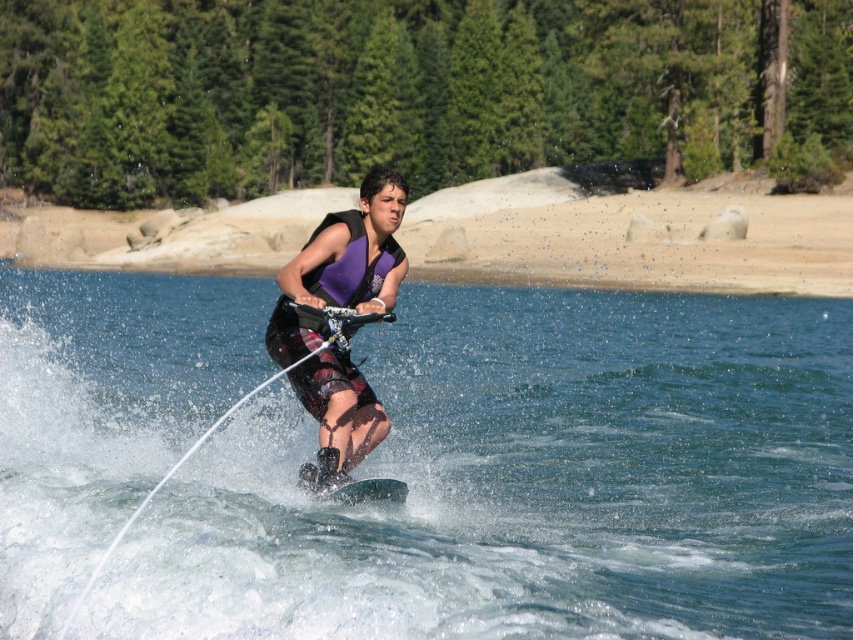
Does point (471, 26) lie behind point (361, 484)?

Yes, point (471, 26) is farther from viewer.

Is green textured tree at upper center above green smooth board at center?

Indeed, green textured tree at upper center is positioned over green smooth board at center.

Which is in front, point (646, 40) or point (370, 480)?

Positioned in front is point (370, 480).

Where is `green textured tree at upper center`? This screenshot has height=640, width=853. green textured tree at upper center is located at coordinates (410, 92).

Image resolution: width=853 pixels, height=640 pixels. In order to click on purple matte life vest at center in this screenshot , I will do `click(328, 323)`.

Is purple matte life vest at center smaller than green smooth board at center?

No.

Which is behind, point (346, 442) or point (305, 480)?

The point (346, 442) is behind.

The height and width of the screenshot is (640, 853). Find the location of `purple matte life vest at center`. purple matte life vest at center is located at coordinates (328, 323).

Who is higher up, green textured tree at upper center or purple matte life vest at center?

green textured tree at upper center is above.

Which of these two, green textured tree at upper center or purple matte life vest at center, stands taller?

green textured tree at upper center

Is point (555, 88) closer to viewer compared to point (294, 380)?

No, it is not.

I want to click on green textured tree at upper center, so click(x=410, y=92).